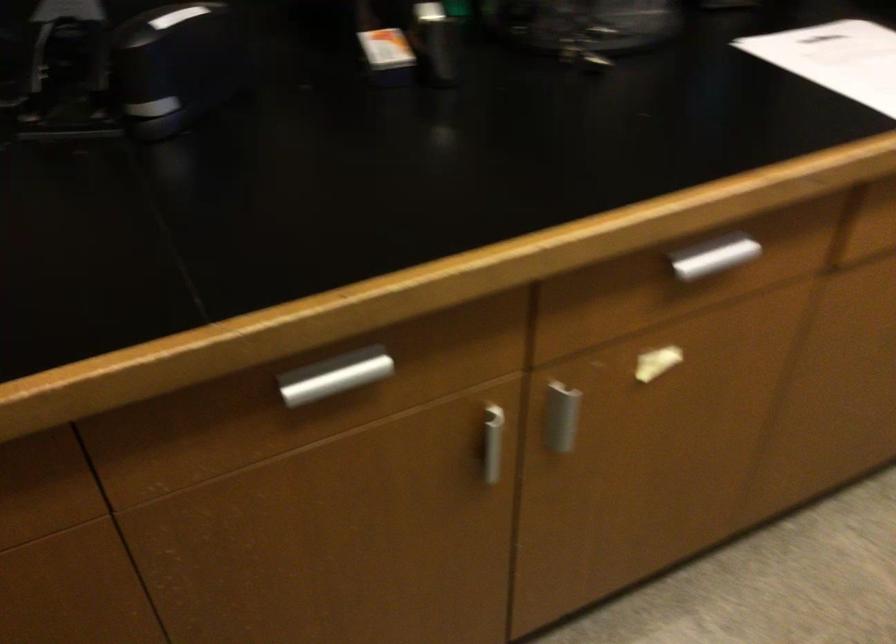
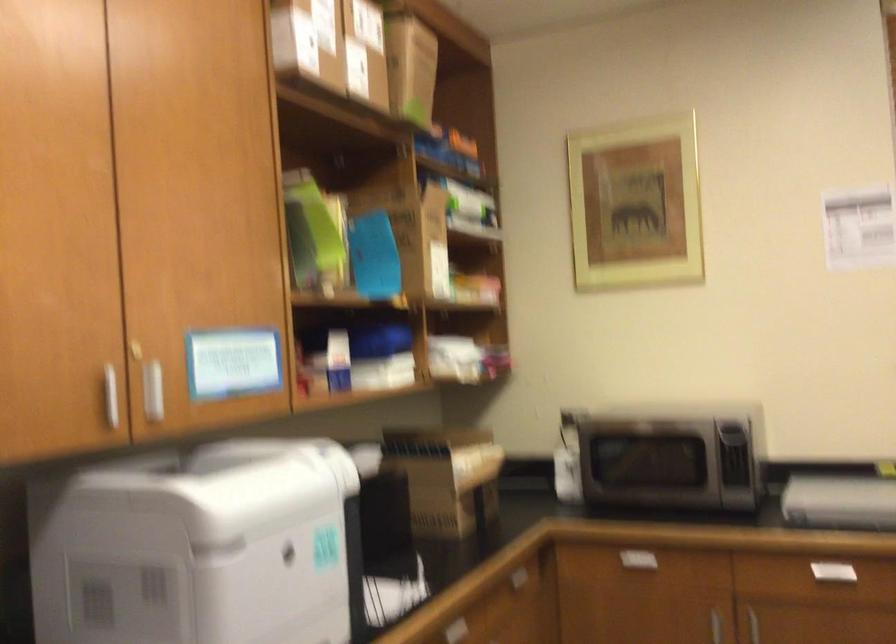
Based on the continuous images, in which direction is the camera rotating?

The camera rotated toward right-up.